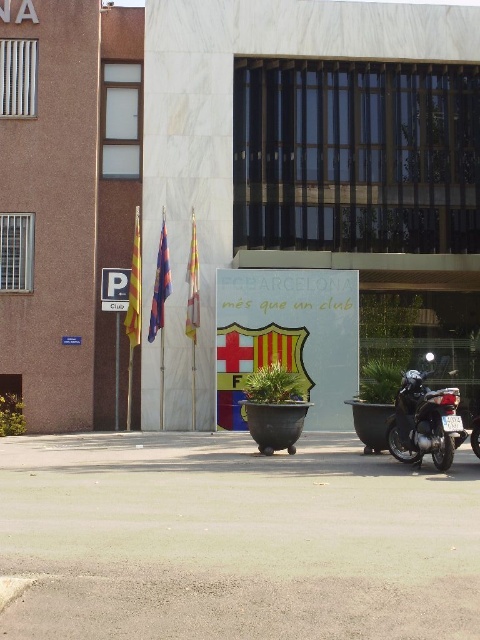
Measure the distance between polyester flag at left and camera.

polyester flag at left is 23.41 meters from camera.

Which is above, polyester flag at left or silky fabric flag at center?

silky fabric flag at center is higher up.

Is point (158, 272) more distant than point (192, 339)?

Yes.

Find the location of a particular element. This screenshot has width=480, height=640. polyester flag at left is located at coordinates (159, 284).

Can you confirm if shiny black motorcycle at lower right is positioned above silky fabric flag at center?

Actually, shiny black motorcycle at lower right is below silky fabric flag at center.

Who is taller, shiny black motorcycle at lower right or silky fabric flag at center?

Standing taller between the two is silky fabric flag at center.

Between point (456, 440) and point (191, 230), which one is positioned in front?

Point (456, 440)

At what (x,y) coordinates should I click in order to perform the action: click on shiny black motorcycle at lower right. Please return your answer as a coordinate pair (x, y). The height and width of the screenshot is (640, 480). Looking at the image, I should click on (424, 420).

From the picture: Does shiny black motorcycle at lower right appear on the left side of yellow fabric flag at left?

No, shiny black motorcycle at lower right is not to the left of yellow fabric flag at left.

Measure the distance from shiny black motorcycle at lower right to yellow fabric flag at left.

shiny black motorcycle at lower right and yellow fabric flag at left are 8.95 meters apart.

This screenshot has height=640, width=480. Describe the element at coordinates (424, 420) in the screenshot. I see `shiny black motorcycle at lower right` at that location.

At what (x,y) coordinates should I click in order to perform the action: click on shiny black motorcycle at lower right. Please return your answer as a coordinate pair (x, y). The height and width of the screenshot is (640, 480). Looking at the image, I should click on (424, 420).